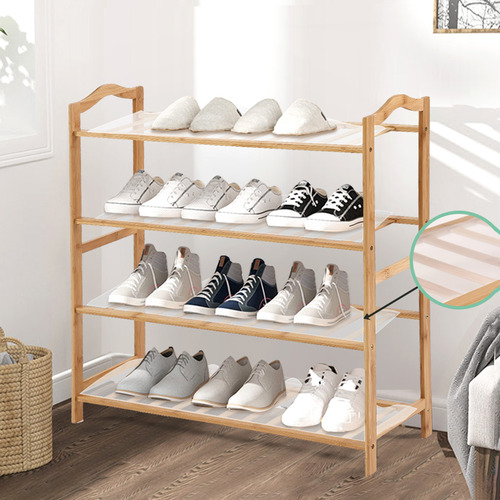
Identify the location of shelves. (119, 129), (107, 220), (98, 306), (95, 391).